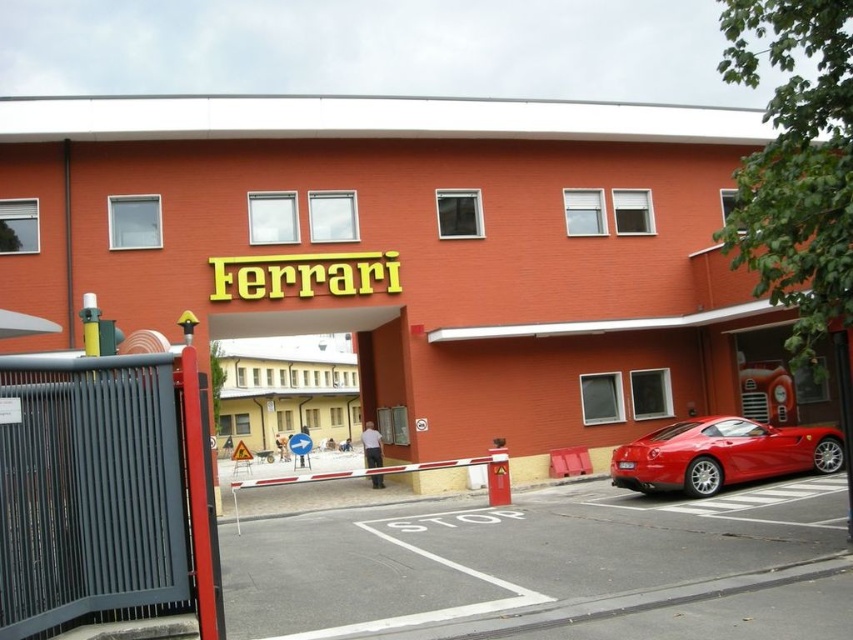
Question: Which of the following is the closest to the observer?

Choices:
 (A) (735, 476)
 (B) (45, 291)

Answer: (A)

Question: Estimate the real-world distances between objects in this image. Which object is farther from the glossy red car at right?

Choices:
 (A) glossy red sports car at lower right
 (B) metallic gate at center

Answer: (A)

Question: Can you confirm if glossy red car at right is positioned to the left of metallic gate at center?

Choices:
 (A) no
 (B) yes

Answer: (A)

Question: Can you confirm if glossy red car at right is wider than glossy red sports car at lower right?

Choices:
 (A) yes
 (B) no

Answer: (A)

Question: Observing the image, what is the correct spatial positioning of glossy red car at right in reference to metallic gate at center?

Choices:
 (A) below
 (B) above

Answer: (A)

Question: Among these objects, which one is nearest to the camera?

Choices:
 (A) glossy red car at right
 (B) metallic gate at center
 (C) glossy red sports car at lower right

Answer: (C)